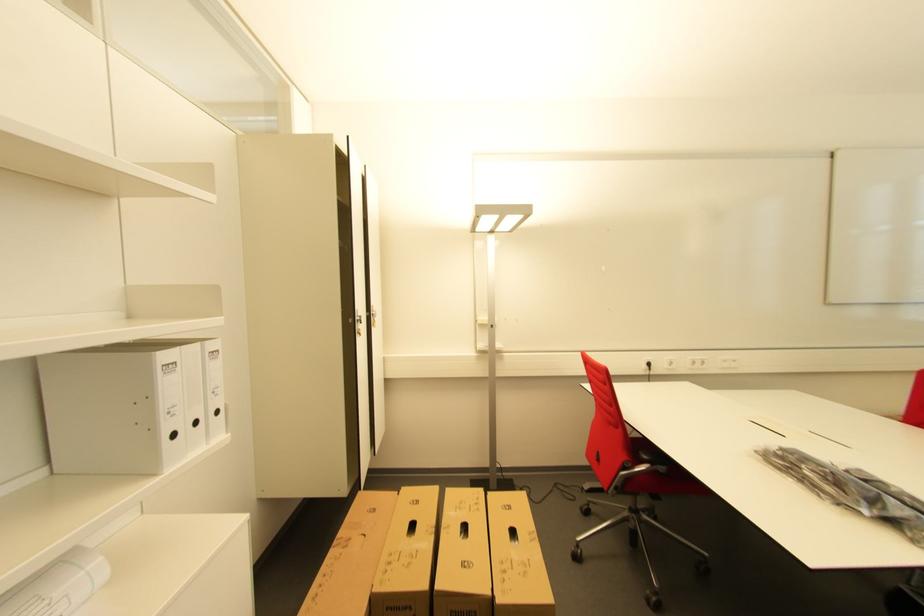
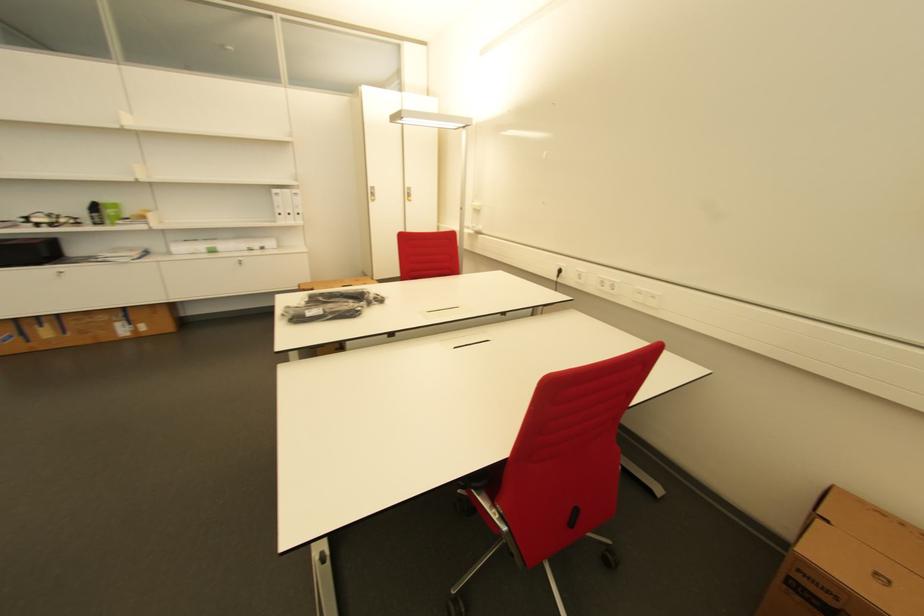
Locate, in the second image, the point that corresponds to the point at 739,362 in the first image.

(659, 299)